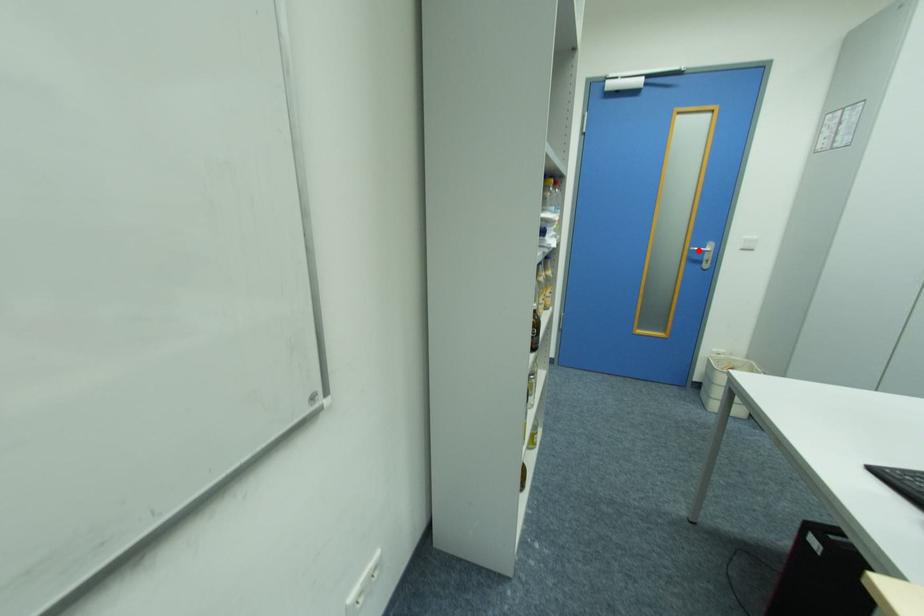
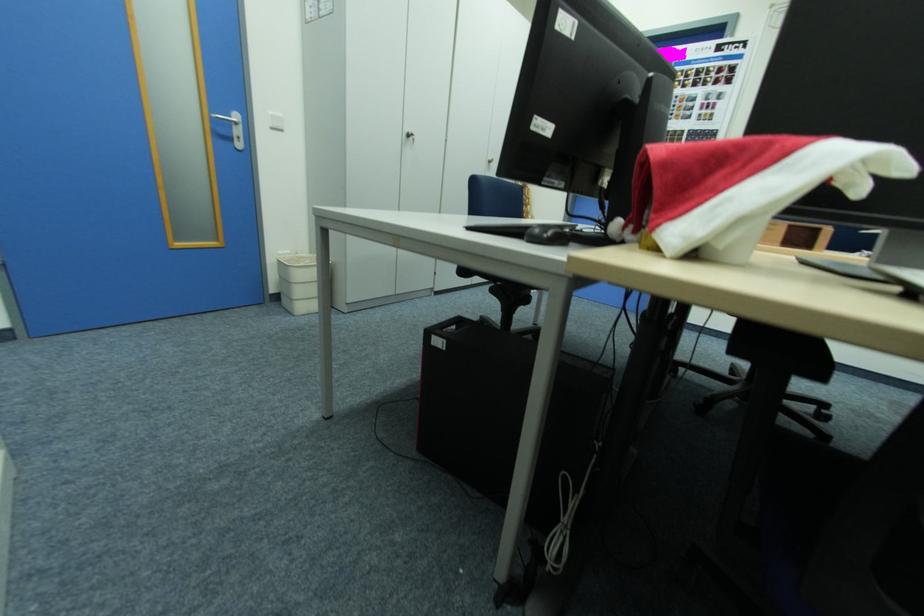
Find the pixel in the second image that matches the highlighted location in the first image.

(222, 119)